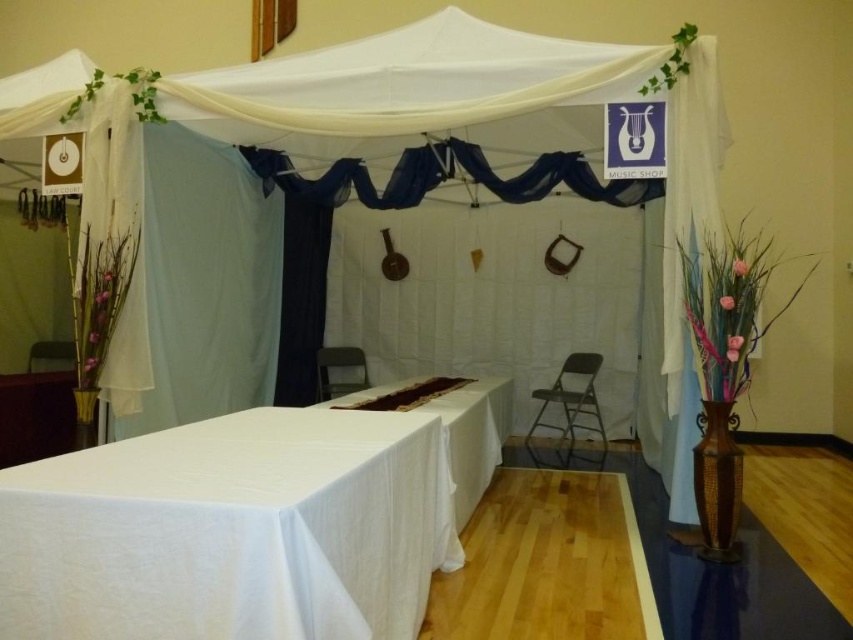
Question: Is white fabric tablecloth at center wider than metallic gray chair at lower left?

Choices:
 (A) yes
 (B) no

Answer: (A)

Question: Which object is the farthest from the metallic gray folding chair at center?

Choices:
 (A) white fabric tablecloth at center
 (B) metallic gray chair at lower left
 (C) white cloth table at center

Answer: (B)

Question: From the image, what is the correct spatial relationship of white fabric tablecloth at center in relation to metallic gray chair at lower left?

Choices:
 (A) below
 (B) above

Answer: (A)

Question: Estimate the real-world distances between objects in this image. Which object is farther from the white fabric tent at center?

Choices:
 (A) white cloth table at center
 (B) white fabric tablecloth at center
 (C) metallic gray chair at center
 (D) metallic gray folding chair at center

Answer: (C)

Question: Which object appears closest to the camera in this image?

Choices:
 (A) white cloth table at center
 (B) metallic gray folding chair at center
 (C) white fabric tent at center

Answer: (A)

Question: Where is white fabric tablecloth at center located in relation to metallic gray chair at lower left in the image?

Choices:
 (A) left
 (B) right

Answer: (B)